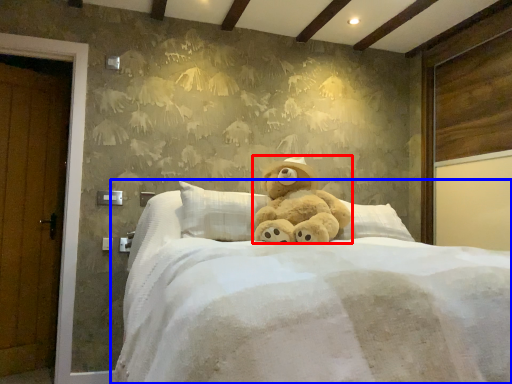
Question: Which object appears farthest to the camera in this image, teddy bear (highlighted by a red box) or bed (highlighted by a blue box)?

Choices:
 (A) teddy bear
 (B) bed

Answer: (A)